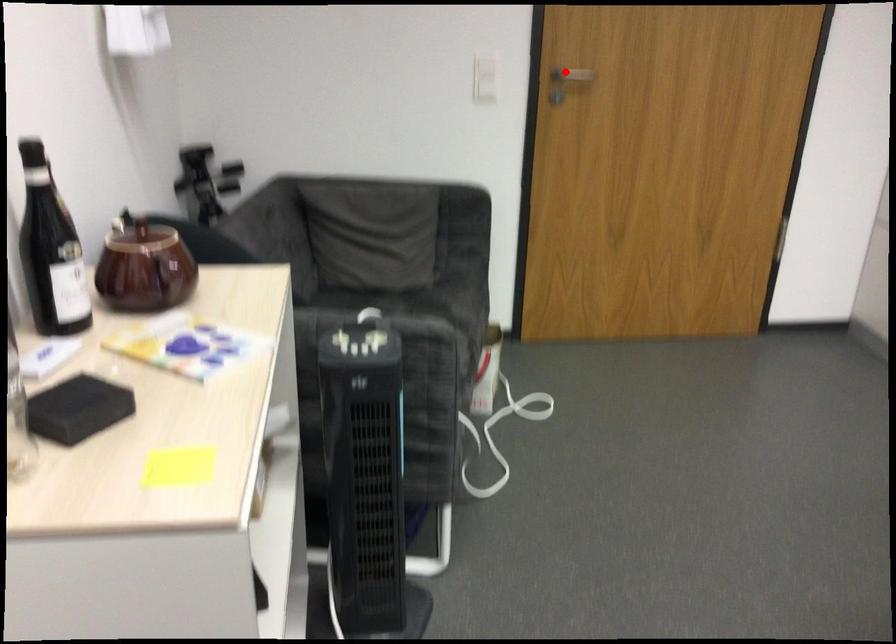
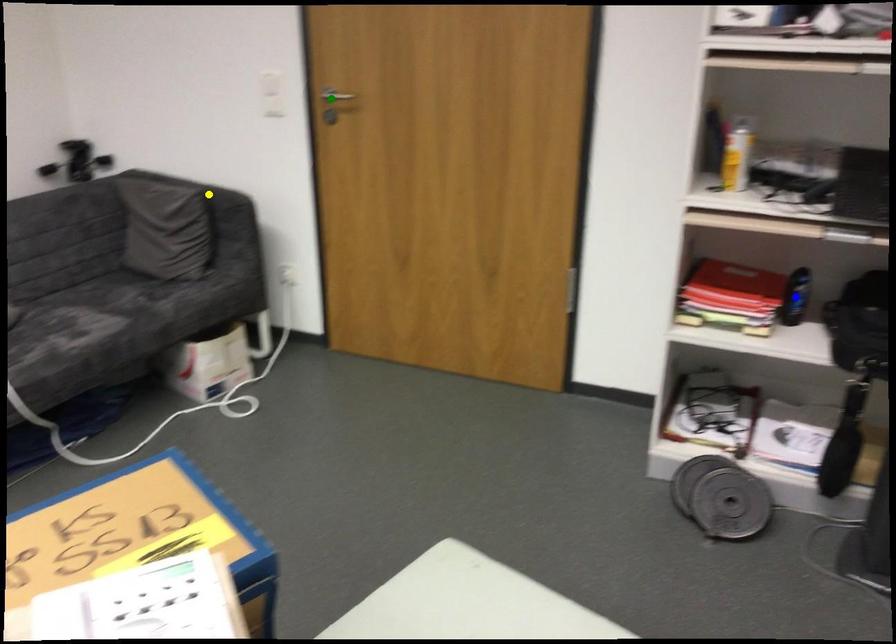
Question: I am providing you with two images of the same scene from different viewpoints. A red point is marked on the first image. You are given multiple points on the second image. In image 2, which mark is for the same physical point as the one in image 1?

Choices:
 (A) green point
 (B) yellow point
 (C) blue point

Answer: (A)